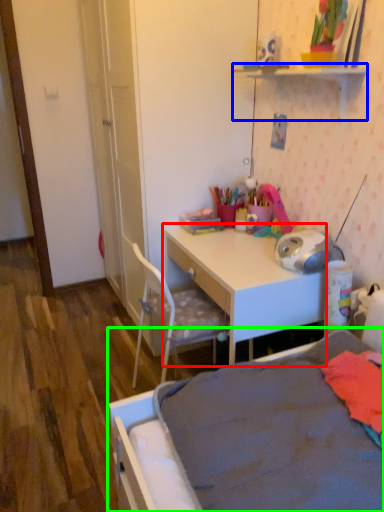
Question: Which is nearer to the desk (highlighted by a red box)? shelf (highlighted by a blue box) or bed (highlighted by a green box).

Choices:
 (A) shelf
 (B) bed

Answer: (B)